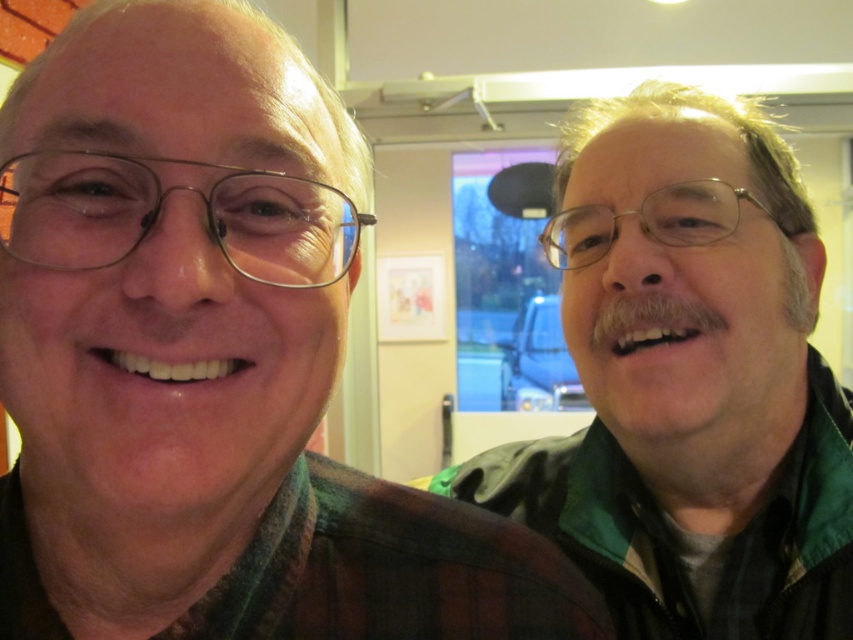
Can you confirm if green plaid shirt at upper right is shorter than green matte jacket at right?

Yes.

Which is behind, point (77, 628) or point (781, 330)?

Positioned behind is point (781, 330).

The width and height of the screenshot is (853, 640). What are the coordinates of `green plaid shirt at upper right` in the screenshot? It's located at (213, 365).

The width and height of the screenshot is (853, 640). In order to click on green plaid shirt at upper right in this screenshot , I will do 213,365.